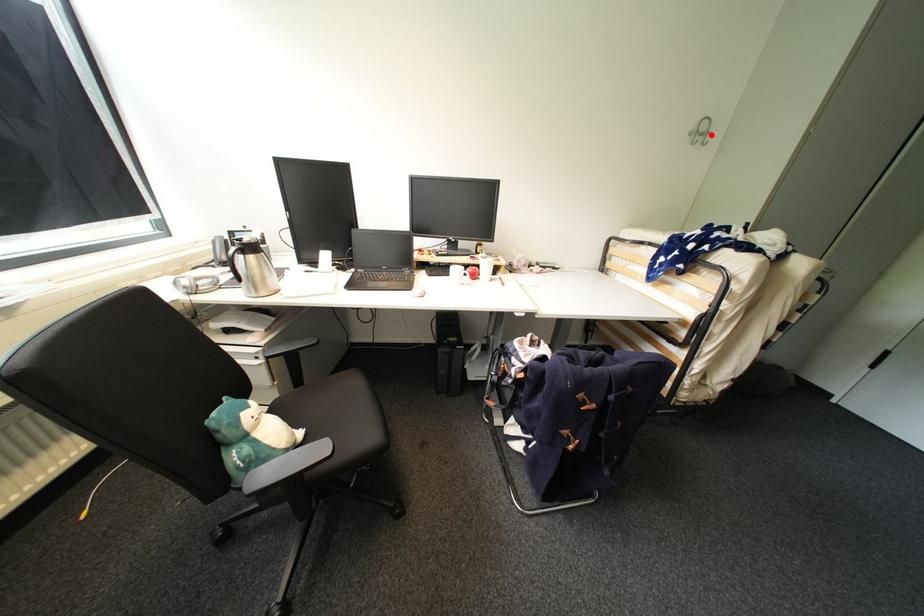
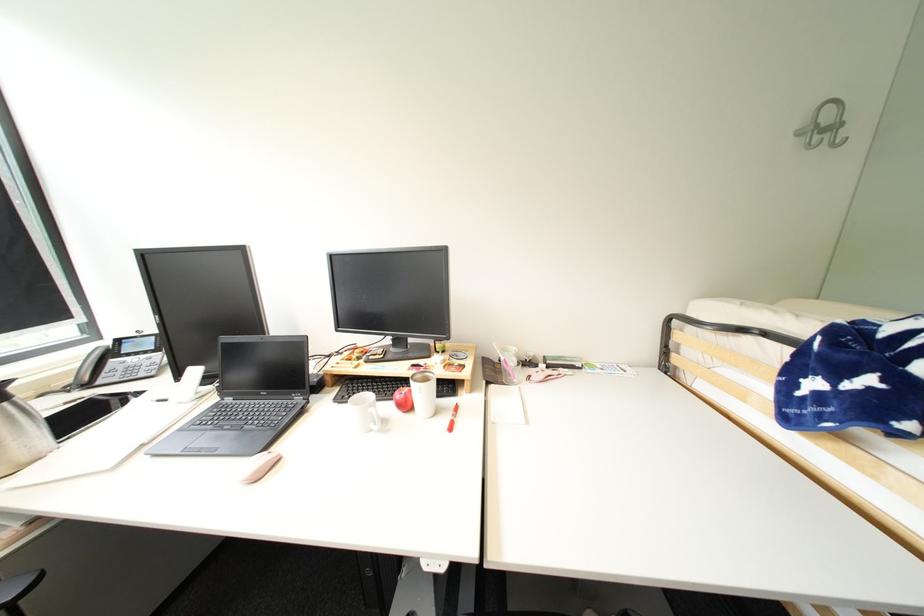
Find the pixel in the second image that matches the highlighted location in the first image.

(841, 128)